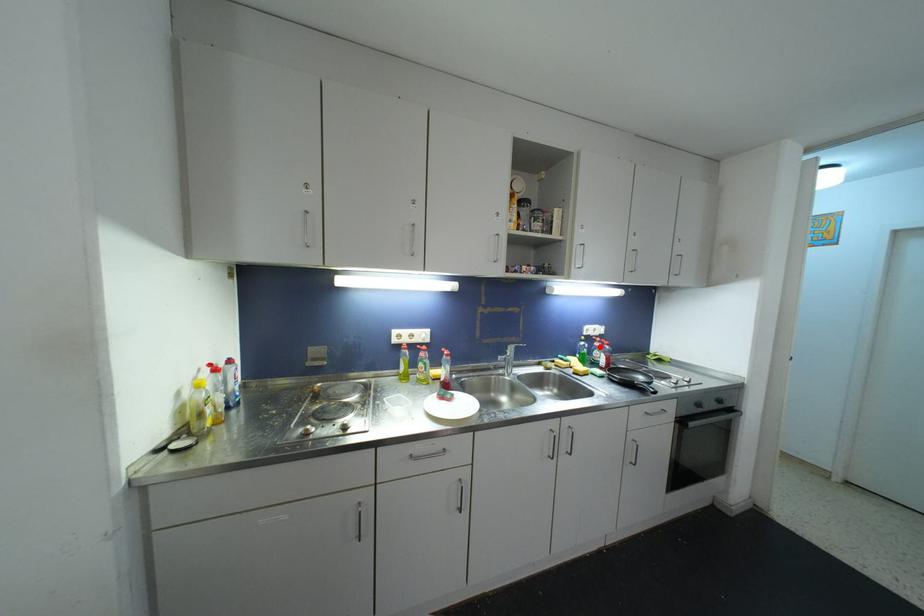
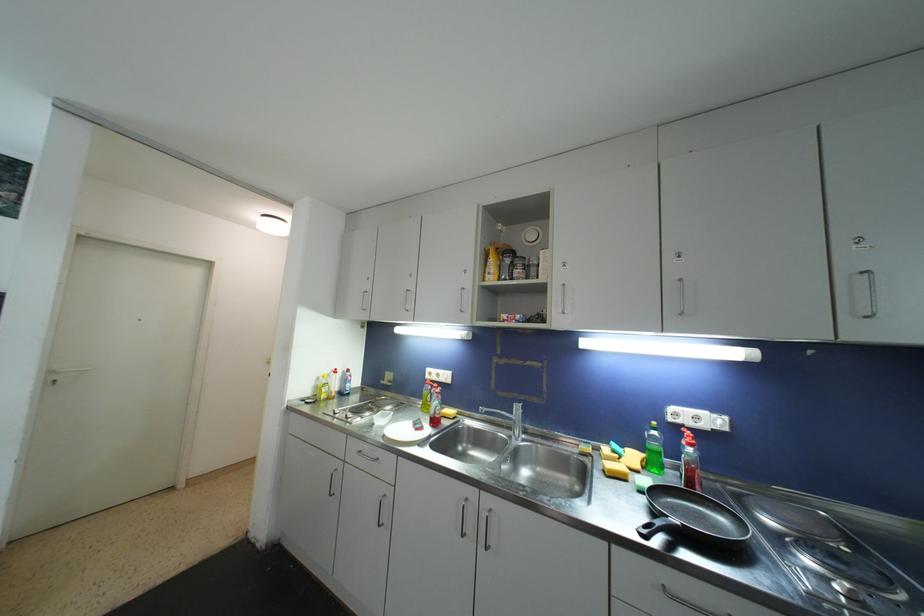
Locate, in the second image, the point that corresponds to the highlighted location in the first image.

(687, 445)